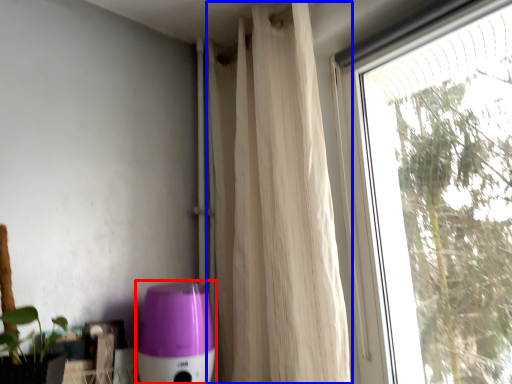
Question: Which point is further to the camera, appliance (highlighted by a red box) or curtain (highlighted by a blue box)?

Choices:
 (A) appliance
 (B) curtain

Answer: (A)